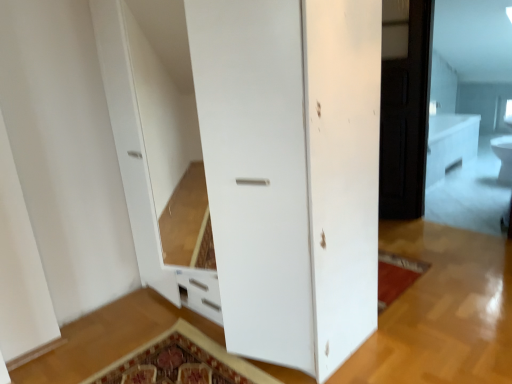
This screenshot has width=512, height=384. What are the coordinates of `vacant region above dark wood screen door at right (from a real-world perspective)` in the screenshot? It's located at (x=396, y=0).